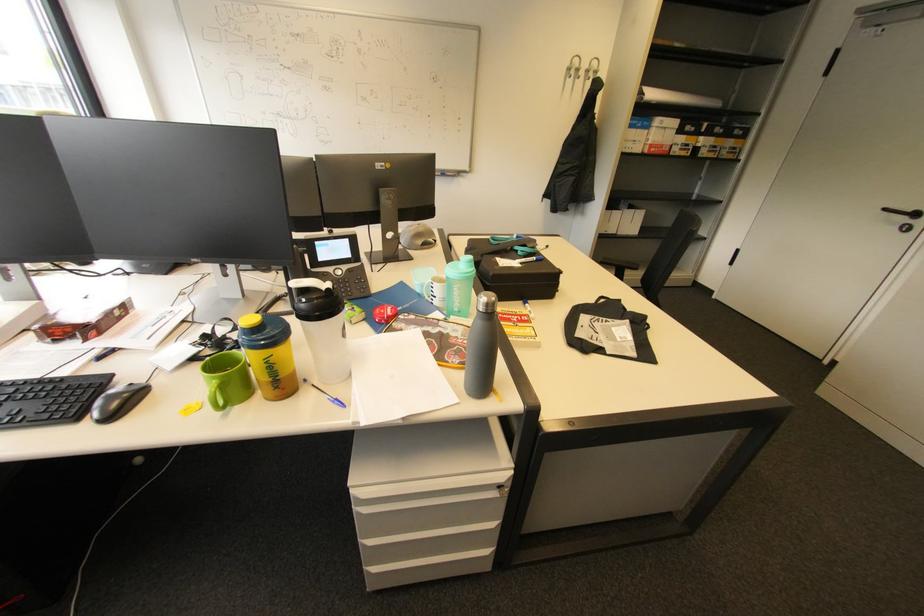
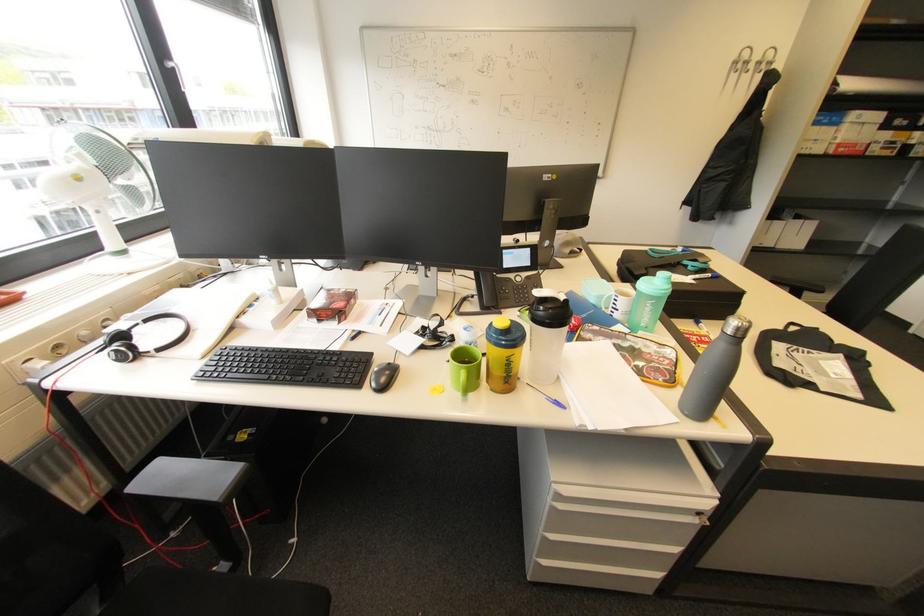
In the second image, find the point that corresponds to point (531, 320) in the first image.

(713, 341)